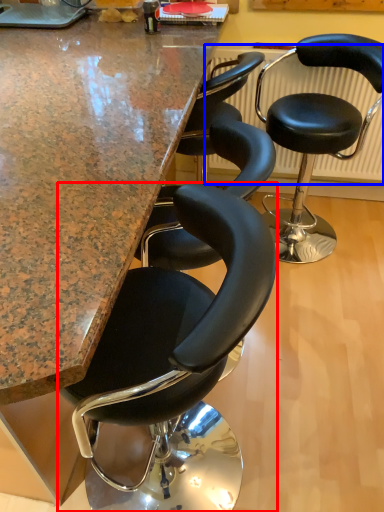
Question: Which object is closer to the camera taking this photo, chair (highlighted by a red box) or radiator (highlighted by a blue box)?

Choices:
 (A) chair
 (B) radiator

Answer: (A)